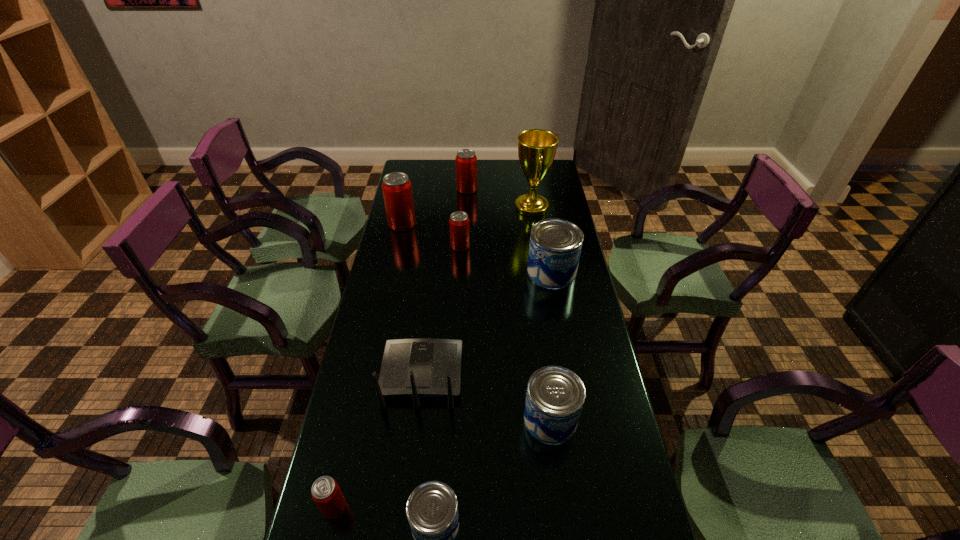
The height and width of the screenshot is (540, 960). Find the location of `free point located 0.230m on the front-facing side of the router`. free point located 0.230m on the front-facing side of the router is located at coordinates (431, 293).

The width and height of the screenshot is (960, 540). Find the location of `free point located on the front-facing side of the router`. free point located on the front-facing side of the router is located at coordinates (435, 263).

At what (x,y) coordinates should I click in order to perform the action: click on free region located on the front-facing side of the router. Please return your answer as a coordinate pair (x, y). Image resolution: width=960 pixels, height=540 pixels. Looking at the image, I should click on (430, 299).

Where is `vacant space located 0.250m on the left of the fifth nearest can`? vacant space located 0.250m on the left of the fifth nearest can is located at coordinates (387, 246).

Find the location of `vacant area situated on the front label of the third nearest can`. vacant area situated on the front label of the third nearest can is located at coordinates (558, 480).

Identify the location of vacant space located 0.300m on the back of the smallest red can. (362, 385).

You are a GUI agent. You are given a task and a screenshot of the screen. Output one action in this format:
    pyautogui.click(x=<x>, y=<y>)
    Task: Click on the object positioned at the far edge
    The height and width of the screenshot is (540, 960).
    Given the screenshot: What is the action you would take?
    click(466, 161)

Identify the location of router that is at the left edge. (424, 367).

Locate an element on the screen. award at the right edge is located at coordinates (536, 147).

At what (x,y) coordinates should I click in order to perform the action: click on free location at the left edge of the desktop. Please return your answer as a coordinate pair (x, y). Looking at the image, I should click on (350, 505).